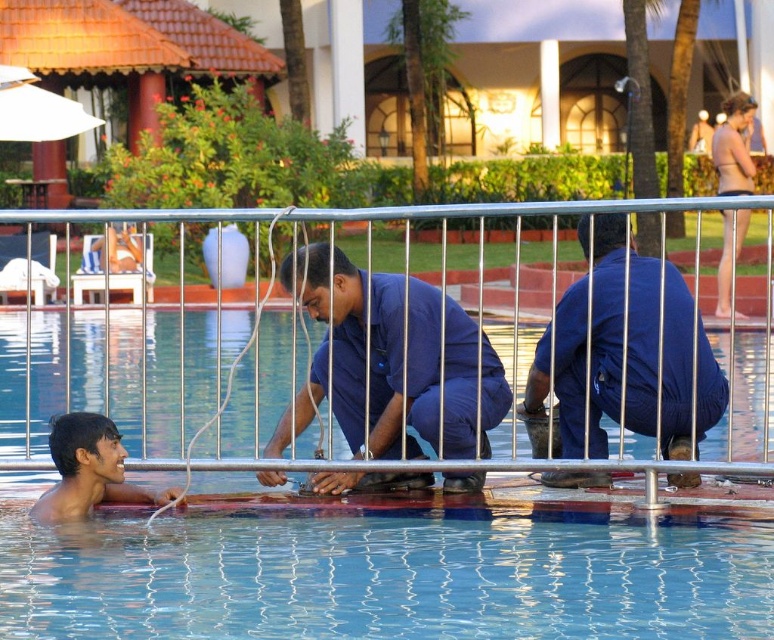
Which is in front, point (341, 257) or point (122, 492)?

Point (122, 492) is in front.

Is point (375, 477) less distant than point (120, 445)?

No, (375, 477) is behind (120, 445).

Between point (447, 392) and point (91, 417), which one is positioned in front?

Point (91, 417) is more forward.

Where is `blue uniform at center`? This screenshot has height=640, width=774. blue uniform at center is located at coordinates (385, 365).

Does blue rubber pool at center appear on the right side of blue uniform at center?

Correct, you'll find blue rubber pool at center to the right of blue uniform at center.

Image resolution: width=774 pixels, height=640 pixels. Describe the element at coordinates (375, 577) in the screenshot. I see `blue rubber pool at center` at that location.

This screenshot has width=774, height=640. What are the coordinates of `blue rubber pool at center` in the screenshot? It's located at (375, 577).

Does metallic silver rail at center appear over blue uniform at center?

Yes, metallic silver rail at center is above blue uniform at center.

Is metallic silver rail at center taller than blue uniform at center?

Correct, metallic silver rail at center is much taller as blue uniform at center.

The width and height of the screenshot is (774, 640). What do you see at coordinates (402, 356) in the screenshot? I see `metallic silver rail at center` at bounding box center [402, 356].

You are a GUI agent. You are given a task and a screenshot of the screen. Output one action in this format:
    pyautogui.click(x=<x>, y=<y>)
    Task: Click on the metallic silver rail at center
    
    Given the screenshot: What is the action you would take?
    pyautogui.click(x=402, y=356)